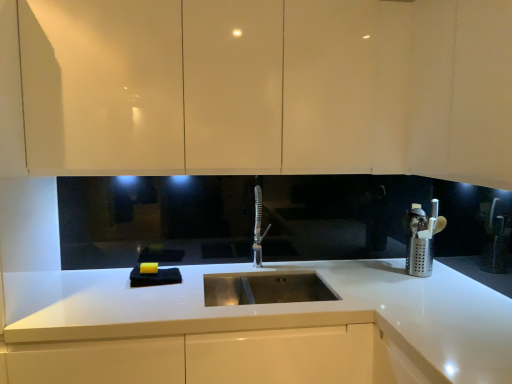
What are the coordinates of `vacant area on the back side of silver perforated utensil holder at right` in the screenshot? It's located at [x=394, y=259].